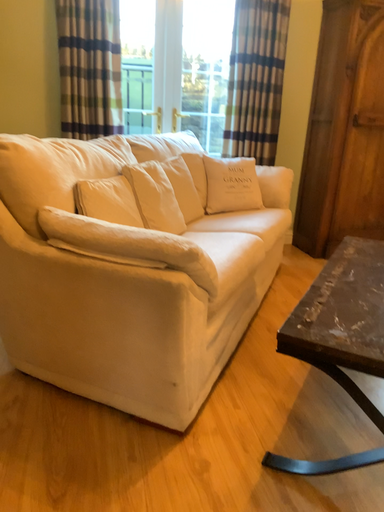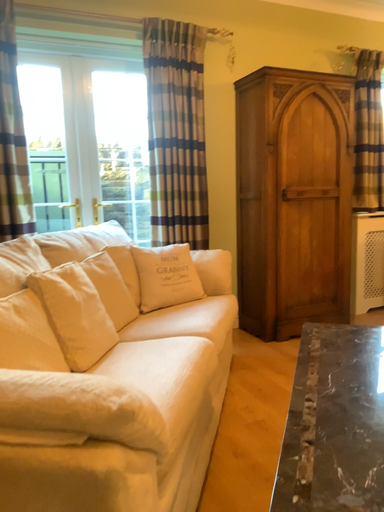
Question: How did the camera likely rotate when shooting the video?

Choices:
 (A) rotated upward
 (B) rotated downward

Answer: (A)